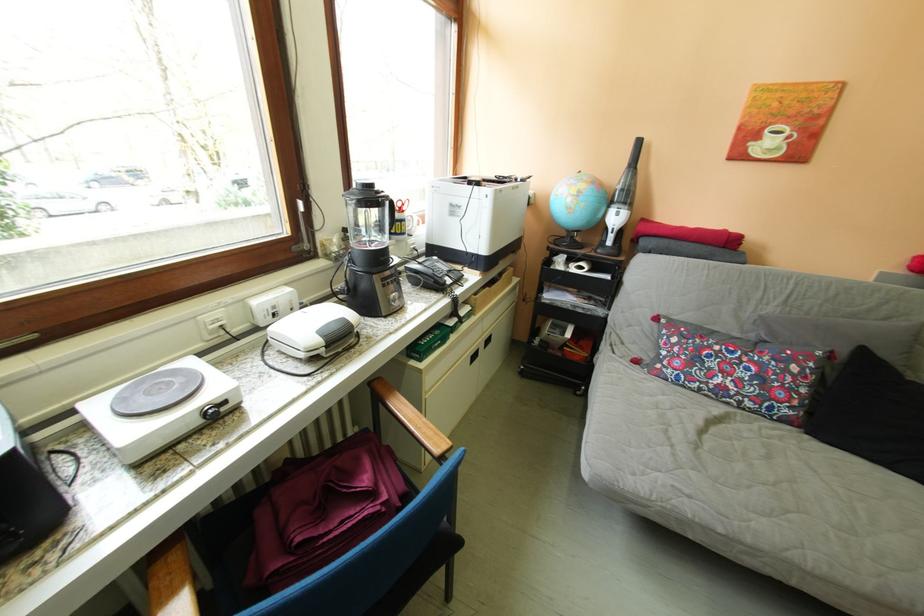
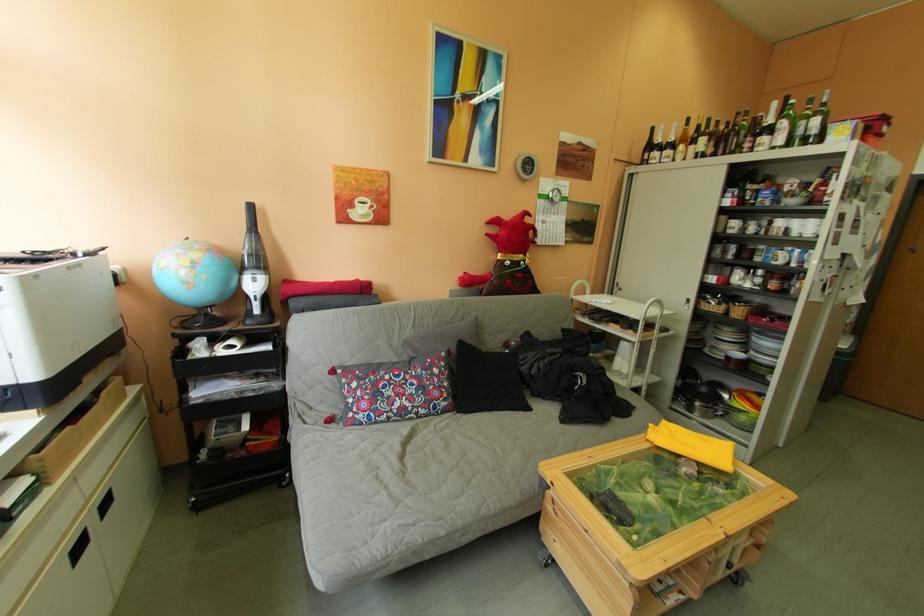
Question: Based on the continuous images, in which direction is the camera rotating? Reply with the corresponding letter.

Choices:
 (A) Left
 (B) Right
 (C) Up
 (D) Down

Answer: (B)